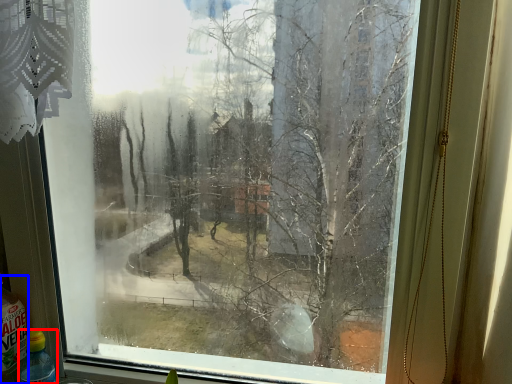
Question: Which point is further to the camera, bottle (highlighted by a red box) or bottle (highlighted by a blue box)?

Choices:
 (A) bottle
 (B) bottle

Answer: (A)